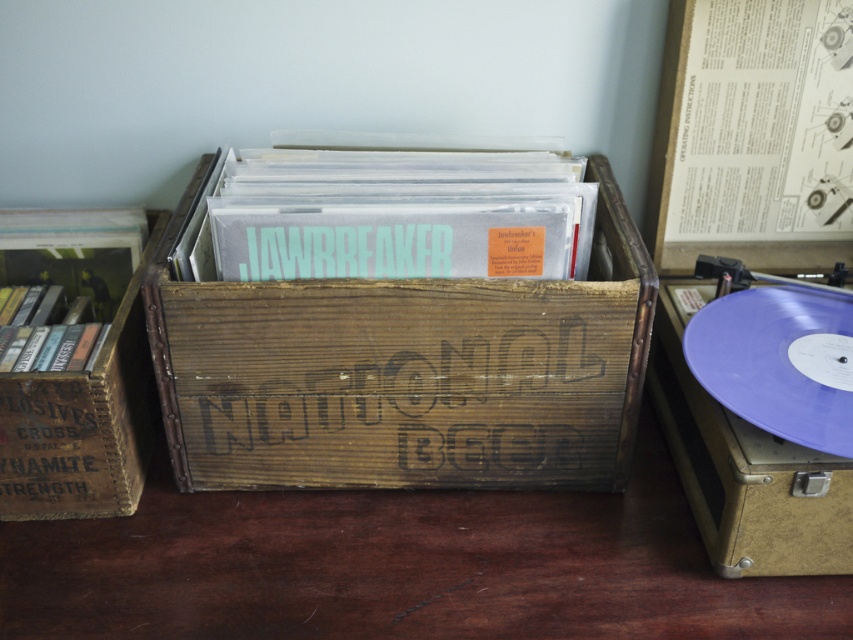
Between purple vinyl record player at right and brown wooden crate at left, which one is positioned lower?

purple vinyl record player at right

Can you confirm if purple vinyl record player at right is taller than brown wooden crate at left?

No.

Locate an element on the screen. The height and width of the screenshot is (640, 853). purple vinyl record player at right is located at coordinates (744, 467).

Who is more distant from viewer, (599, 438) or (755, 568)?

Positioned behind is point (599, 438).

How far apart are wooden crate at center and purple vinyl record player at right?

8.90 inches

Between point (633, 360) and point (672, 413), which one is positioned behind?

The point (672, 413) is behind.

What are the coordinates of `wooden crate at center` in the screenshot? It's located at (405, 372).

How much distance is there between wooden crate at center and brown wooden crate at left?

They are 8.45 inches apart.

The width and height of the screenshot is (853, 640). I want to click on wooden crate at center, so click(405, 372).

Image resolution: width=853 pixels, height=640 pixels. What are the coordinates of `wooden crate at center` in the screenshot? It's located at (405, 372).